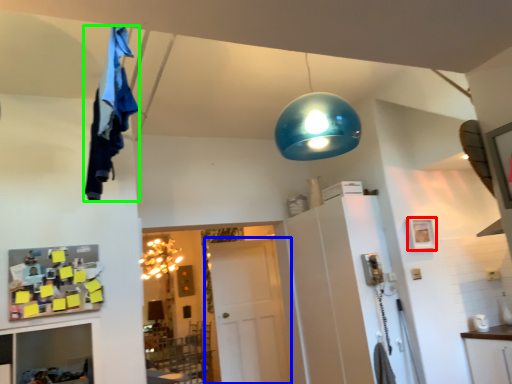
Question: Which object is positioned farthest from picture frame (highlighted by a red box)? Select from door (highlighted by a blue box) and laundry (highlighted by a green box).

Choices:
 (A) door
 (B) laundry

Answer: (B)